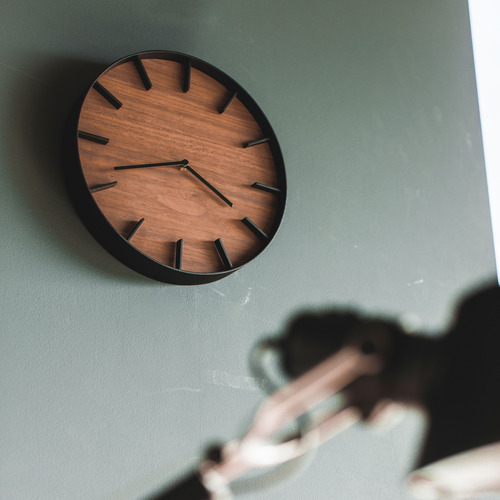
Identify the location of chalk board. (311, 190).